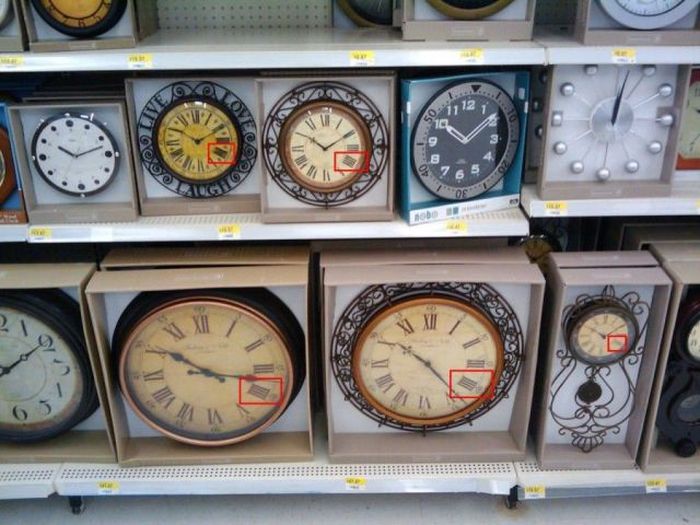
You are a GUI agent. You are given a task and a screenshot of the screen. Output one action in this format:
    pyautogui.click(x=<x>, y=<y>)
    Task: Click on the clock
    
    Given the screenshot: What is the action you would take?
    pyautogui.click(x=598, y=346)